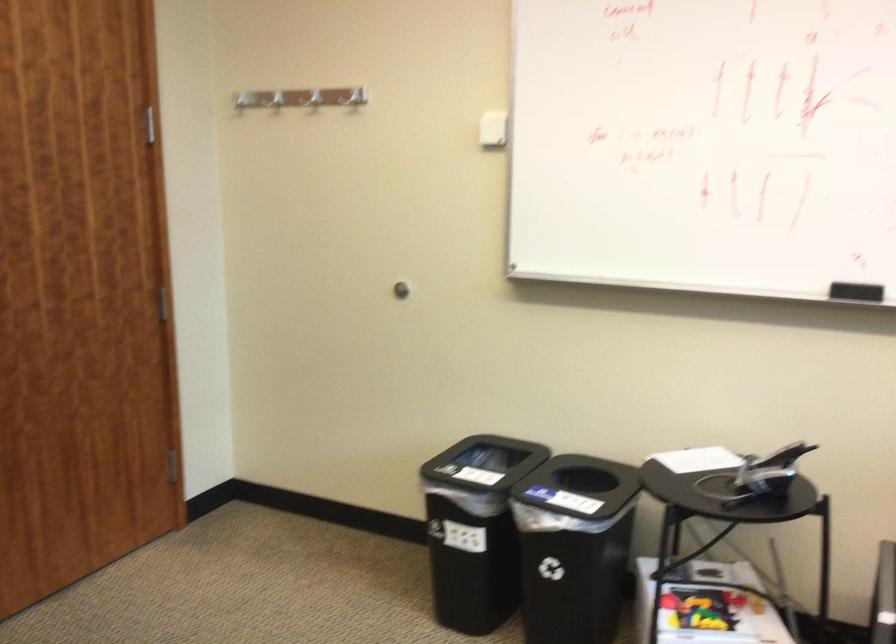
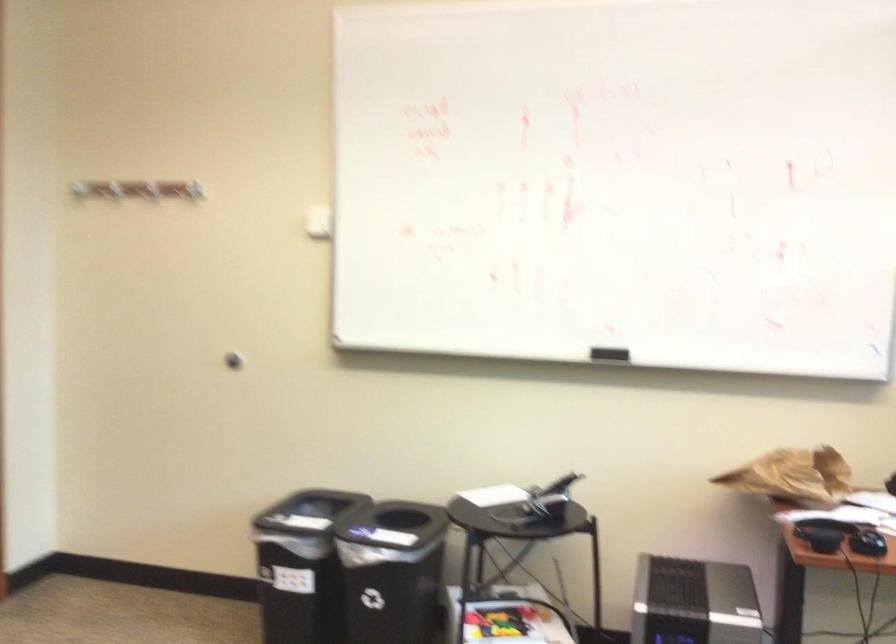
Locate, in the second image, the point that corresponds to [754,471] in the first image.

(539, 503)